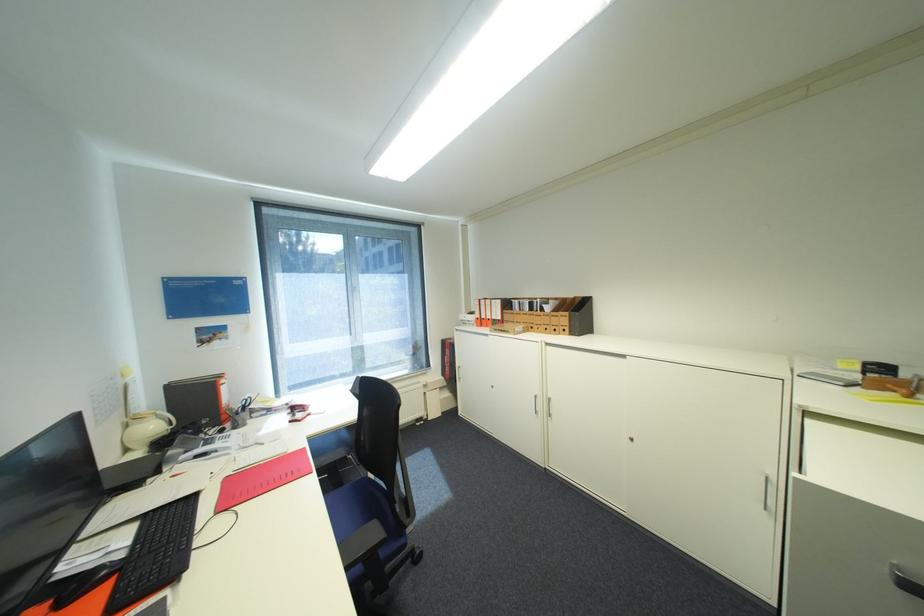
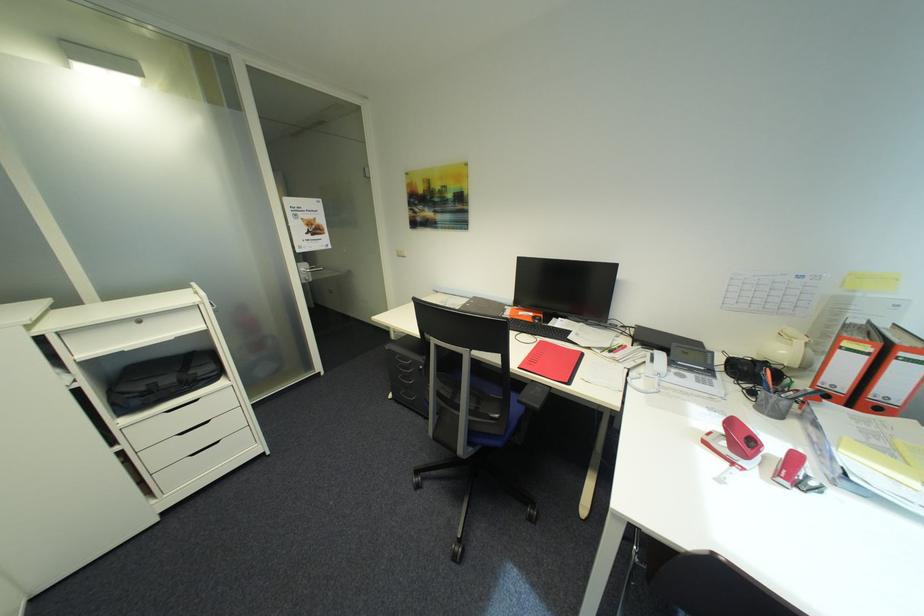
Where in the second image is the point corresponding to (317,415) from the first image?

(742, 464)